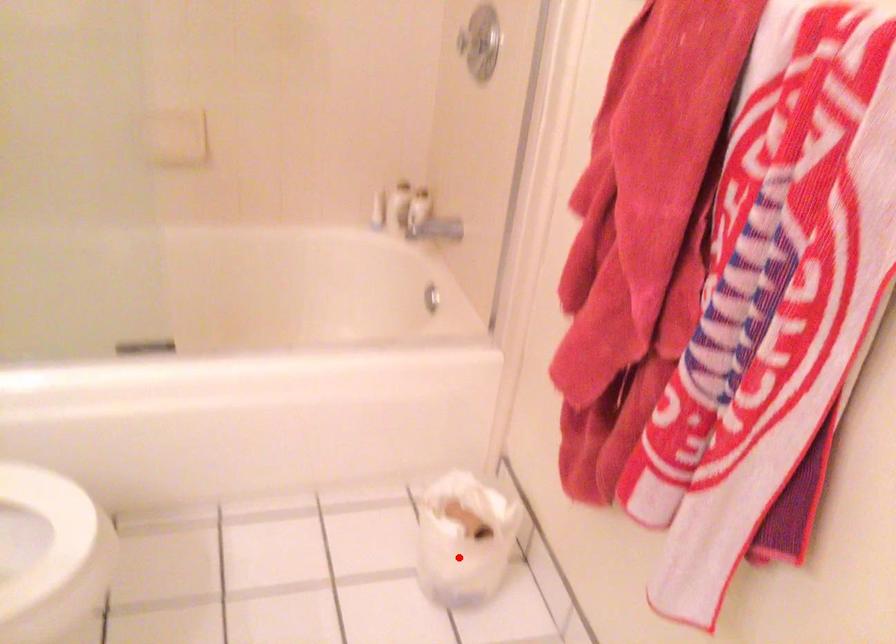
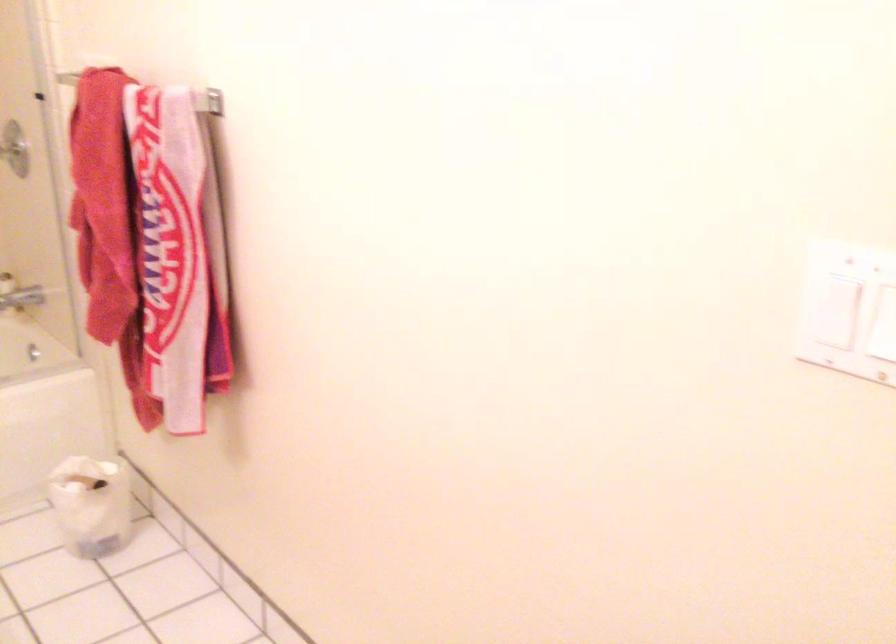
The point at the highlighted location is marked in the first image. Where is the corresponding point in the second image?

(90, 505)